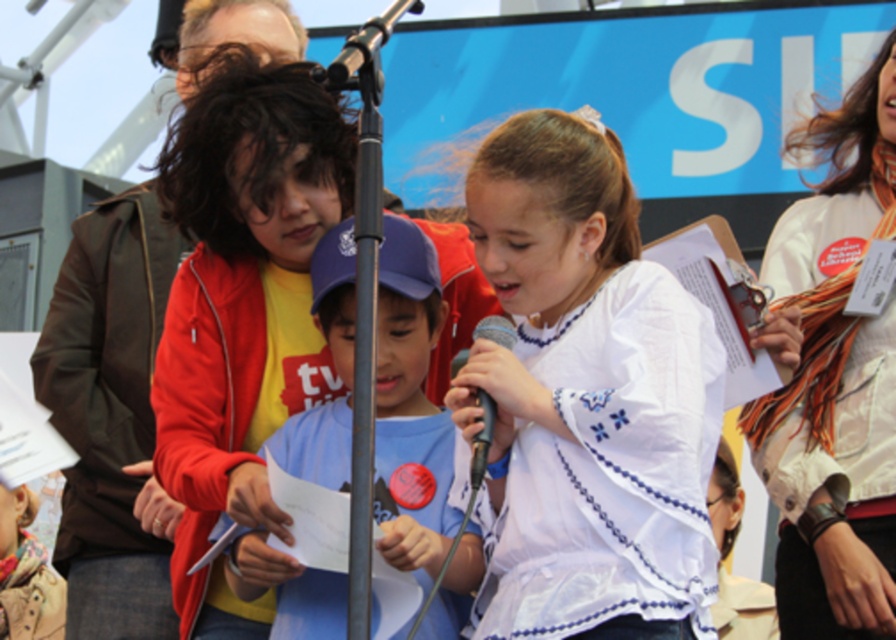
In the scene shown: You are at a public event and want to take a photo of the blue cotton shirt at center without including the white scarf at upper right in the frame. Is this possible based on their positions?

The blue cotton shirt at center is behind the white scarf at upper right, so you can position yourself or adjust your camera angle to exclude the white scarf at upper right from the frame, allowing you to capture the blue cotton shirt at center alone.

You are a photographer at the event and want to capture a photo that includes both the white scarf at upper right and the blue cotton shirt at center. Which object should you focus on first to ensure both are in the frame?

The white scarf at upper right is above the blue cotton shirt at center, so you should focus on the blue cotton shirt at center first to ensure both are in the frame.

You are a photographer standing at the back of the event venue. You want to take a photo of the blue cotton shirt at center and the black plastic microphone at center in the same frame. The camera you are using has a minimum focus distance of 5 meters. Can you capture both objects clearly in your photo?

The blue cotton shirt at center and the black plastic microphone at center are 6.10 meters apart. Since the minimum focus distance is 5 meters, the camera can focus on both objects as they are beyond the minimum required distance.